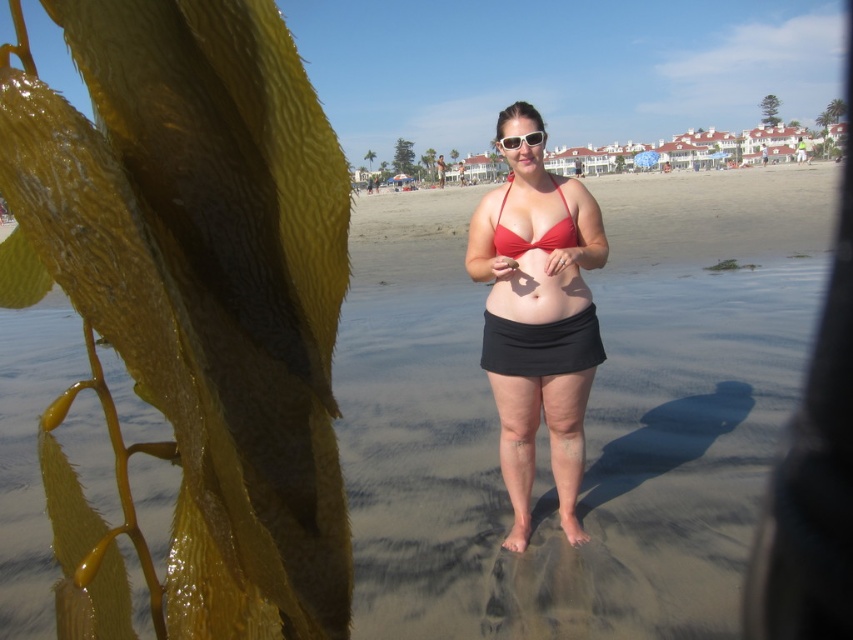
Which of these two, red matte bikini top at center or white plastic sunglasses at center, stands shorter?

With less height is white plastic sunglasses at center.

Is red matte bikini top at center positioned in front of white plastic sunglasses at center?

Yes, it is in front of white plastic sunglasses at center.

Is point (570, 531) closer to viewer compared to point (537, 134)?

That is False.

The image size is (853, 640). I want to click on red matte bikini top at center, so click(538, 324).

Is point (524, 380) less distant than point (505, 256)?

No, it is not.

Can you confirm if red matte bikini top at center is thinner than matte red bikini top at center?

No.

You are a GUI agent. You are given a task and a screenshot of the screen. Output one action in this format:
    pyautogui.click(x=<x>, y=<y>)
    Task: Click on the red matte bikini top at center
    The image size is (853, 640).
    Given the screenshot: What is the action you would take?
    [538, 324]

Where is `red matte bikini top at center`? This screenshot has width=853, height=640. red matte bikini top at center is located at coordinates click(538, 324).

Does matte red bikini top at center have a smaller size compared to white plastic sunglasses at center?

No, matte red bikini top at center is not smaller than white plastic sunglasses at center.

Image resolution: width=853 pixels, height=640 pixels. What do you see at coordinates (540, 236) in the screenshot?
I see `matte red bikini top at center` at bounding box center [540, 236].

Does point (512, 243) come farther from viewer compared to point (543, 141)?

No, (512, 243) is in front of (543, 141).

This screenshot has height=640, width=853. Find the location of `matte red bikini top at center`. matte red bikini top at center is located at coordinates (540, 236).